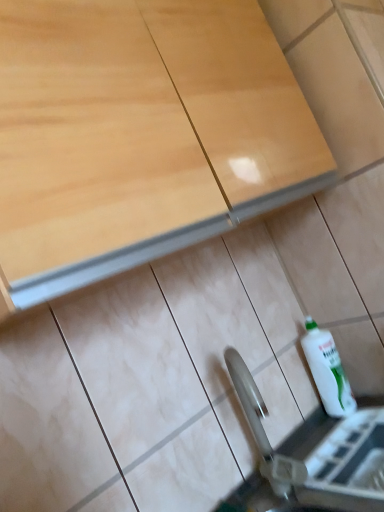
The image size is (384, 512). I want to click on vacant area to the left of white glossy bottle at lower right, so click(319, 432).